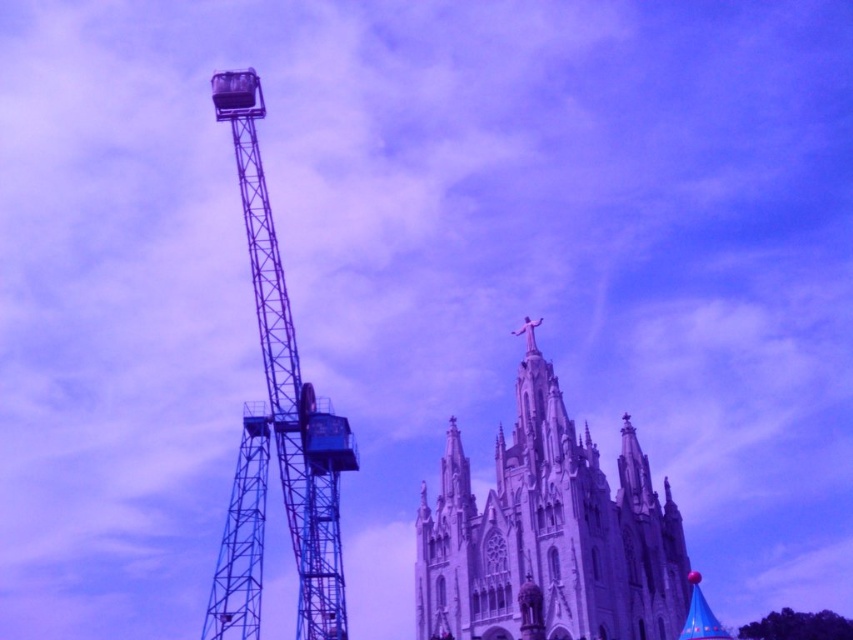
Does white stone church at center come behind metallic blue crane at left?

No, it is not.

Can you confirm if white stone church at center is bigger than metallic blue crane at left?

No.

Who is more forward, (650, 520) or (235, 106)?

Point (235, 106) is more forward.

At what (x,y) coordinates should I click in order to perform the action: click on white stone church at center. Please return your answer as a coordinate pair (x, y). Looking at the image, I should click on (549, 534).